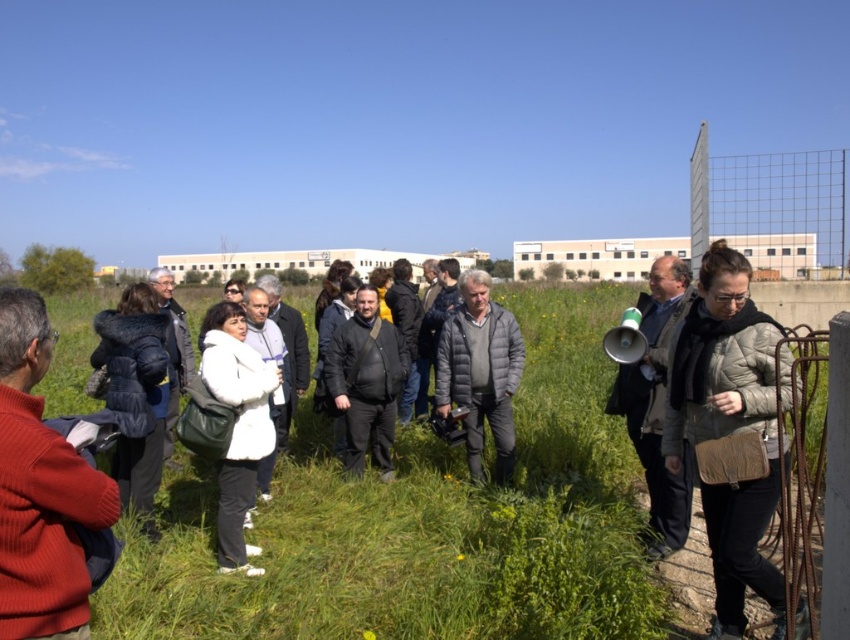
Measure the distance between point (661, 312) and camera.

4.63 meters

Does dark gray jacket at right appear on the left side of dark gray jacket at center?

In fact, dark gray jacket at right is to the right of dark gray jacket at center.

The width and height of the screenshot is (850, 640). Identify the location of dark gray jacket at right. (656, 403).

Does dark blue fur coat at center-left appear on the right side of dark gray jacket at center?

In fact, dark blue fur coat at center-left is to the left of dark gray jacket at center.

Which is more to the right, dark blue fur coat at center-left or dark gray jacket at center?

dark gray jacket at center is more to the right.

Is point (119, 465) positioned after point (391, 404)?

No.

Identify the location of dark blue fur coat at center-left. (136, 394).

Between dark blue fur coat at center-left and white fur coat at center, which one is positioned higher?

dark blue fur coat at center-left is above.

Is point (129, 320) behind point (246, 451)?

Yes, point (129, 320) is behind point (246, 451).

Which is in front, point (112, 353) or point (234, 529)?

Point (234, 529) is in front.

This screenshot has width=850, height=640. Find the location of `dark blue fur coat at center-left`. dark blue fur coat at center-left is located at coordinates (136, 394).